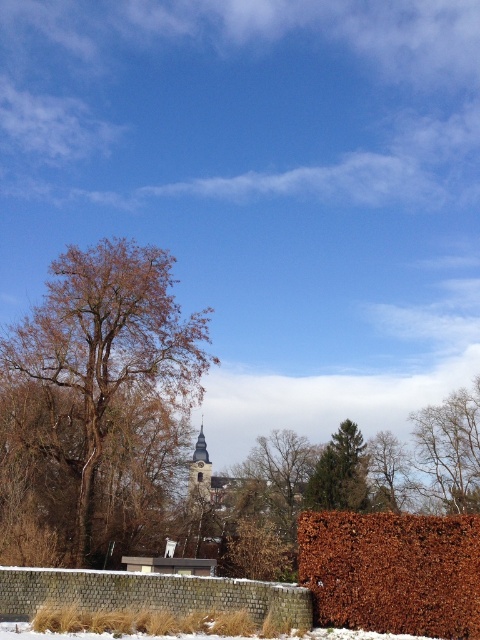
Who is shorter, brown rough bark tree at left or brown leafy tree at center?

brown leafy tree at center is shorter.

Can you confirm if brown rough bark tree at left is thinner than brown leafy tree at center?

In fact, brown rough bark tree at left might be wider than brown leafy tree at center.

Is point (104, 461) farther from camera compared to point (393, 458)?

No, it is in front of (393, 458).

Find the location of a particular element. This screenshot has height=640, width=480. brown rough bark tree at left is located at coordinates (100, 380).

Between bare branches at center and green needle-like tree at center, which one appears on the right side from the viewer's perspective?

green needle-like tree at center

This screenshot has height=640, width=480. Identify the location of bare branches at center. (276, 477).

Who is more forward, (134, 316) or (365, 483)?

Positioned in front is point (134, 316).

Does point (72, 433) come closer to viewer compared to point (346, 449)?

Yes, point (72, 433) is closer to viewer.

Locate an element on the screen. brown rough bark tree at left is located at coordinates (100, 380).

Where is `brown rough bark tree at left`? brown rough bark tree at left is located at coordinates (100, 380).